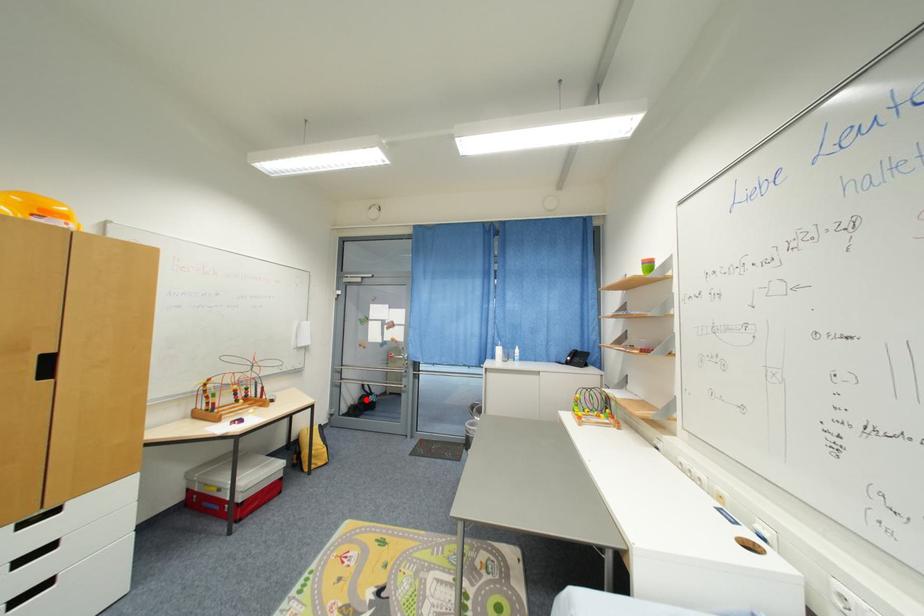
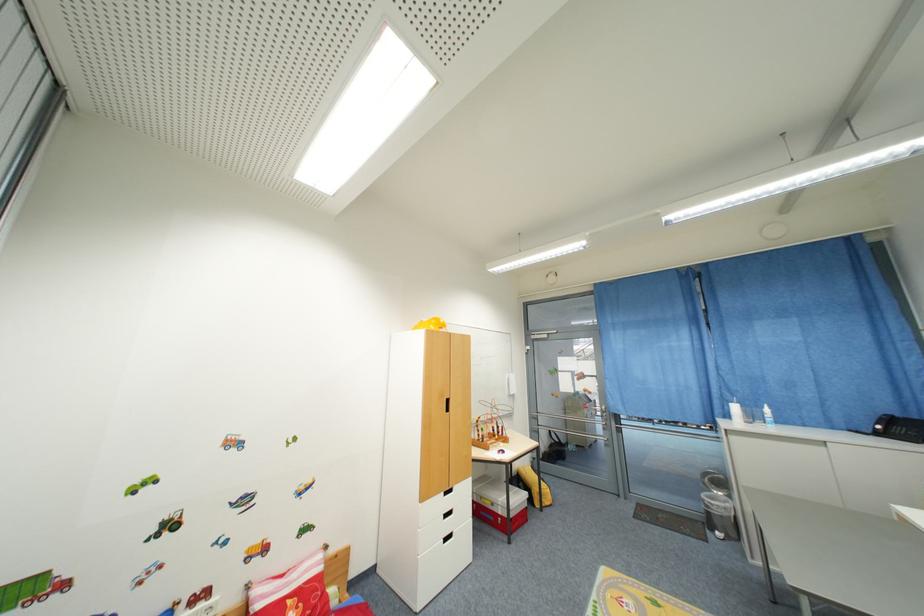
Question: I am providing you with two images of the same scene from different viewpoints. In image1, a red point is highlighted. Considering the same 3D point in image2, which of the following is correct?

Choices:
 (A) It is closer
 (B) It is farther

Answer: (B)